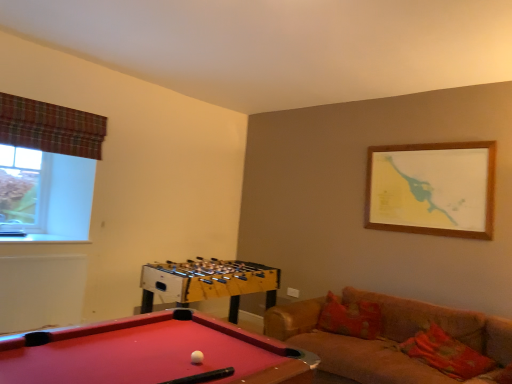
Question: Can you confirm if clear glass window at upper left is taller than plaid fabric curtain at upper left?

Choices:
 (A) no
 (B) yes

Answer: (B)

Question: Is the position of clear glass window at upper left more distant than that of plaid fabric curtain at upper left?

Choices:
 (A) no
 (B) yes

Answer: (B)

Question: Does clear glass window at upper left have a smaller size compared to plaid fabric curtain at upper left?

Choices:
 (A) no
 (B) yes

Answer: (A)

Question: Considering the relative sizes of clear glass window at upper left and plaid fabric curtain at upper left in the image provided, is clear glass window at upper left shorter than plaid fabric curtain at upper left?

Choices:
 (A) no
 (B) yes

Answer: (A)

Question: Considering the relative sizes of clear glass window at upper left and plaid fabric curtain at upper left in the image provided, is clear glass window at upper left bigger than plaid fabric curtain at upper left?

Choices:
 (A) yes
 (B) no

Answer: (A)

Question: From a real-world perspective, is white matte ball at center physically located above or below smooth red pool table at lower left?

Choices:
 (A) above
 (B) below

Answer: (A)

Question: In terms of width, does white matte ball at center look wider or thinner when compared to smooth red pool table at lower left?

Choices:
 (A) wide
 (B) thin

Answer: (B)

Question: Is white matte ball at center spatially inside smooth red pool table at lower left, or outside of it?

Choices:
 (A) inside
 (B) outside

Answer: (A)

Question: From their relative heights in the image, would you say white matte ball at center is taller or shorter than smooth red pool table at lower left?

Choices:
 (A) tall
 (B) short

Answer: (B)

Question: From a real-world perspective, is white matte ball at center physically located above or below plaid fabric curtain at upper left?

Choices:
 (A) above
 (B) below

Answer: (B)

Question: Which is correct: white matte ball at center is inside plaid fabric curtain at upper left, or outside of it?

Choices:
 (A) outside
 (B) inside

Answer: (A)

Question: In the image, is white matte ball at center on the left side or the right side of plaid fabric curtain at upper left?

Choices:
 (A) left
 (B) right

Answer: (B)

Question: Is white matte ball at center taller or shorter than plaid fabric curtain at upper left?

Choices:
 (A) short
 (B) tall

Answer: (A)

Question: From a real-world perspective, is white matte ball at center above or below clear glass window at upper left?

Choices:
 (A) above
 (B) below

Answer: (B)

Question: Considering the positions of white matte ball at center and clear glass window at upper left in the image, is white matte ball at center taller or shorter than clear glass window at upper left?

Choices:
 (A) short
 (B) tall

Answer: (A)